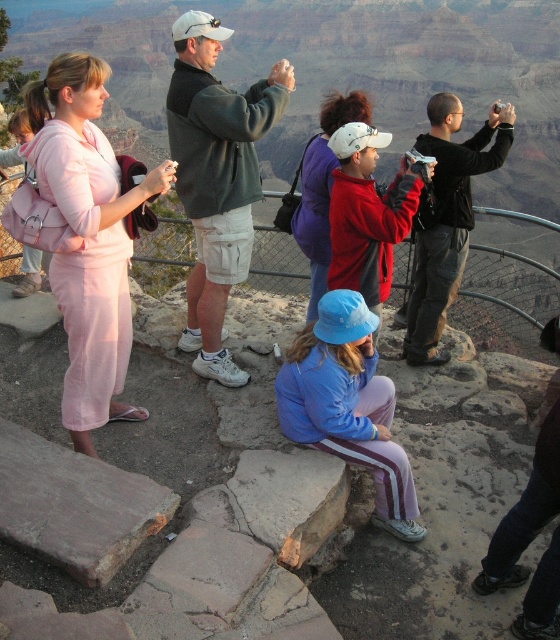
You are a photographer wanting to capture both the blue fabric jacket at center and the matte red jacket at center in a single frame. Which jacket will appear wider in your photo?

The matte red jacket at center will appear wider in the photo because it has a greater width compared to the blue fabric jacket at center.

You are standing at the viewpoint overlooking the Grand Canyon. There are two points marked on the path in front of you. The first point is at coordinates point [124,408] and the second point is at point [311,230]. If you were to walk from the viewpoint towards the edge of the canyon, which point would you encounter first?

Point [124,408] is in front of point [311,230], so you would encounter point [124,408] first as you walk towards the edge of the canyon.

You are a photographer trying to capture a shot of both the pink fabric dress at left and the matte red jacket at center. Since you want to ensure both are clearly visible in the frame, which object should you focus on first to account for their sizes?

The pink fabric dress at left has a lesser width compared to the matte red jacket at center, so you should focus on the pink fabric dress at left first to ensure it is clearly visible in the frame.